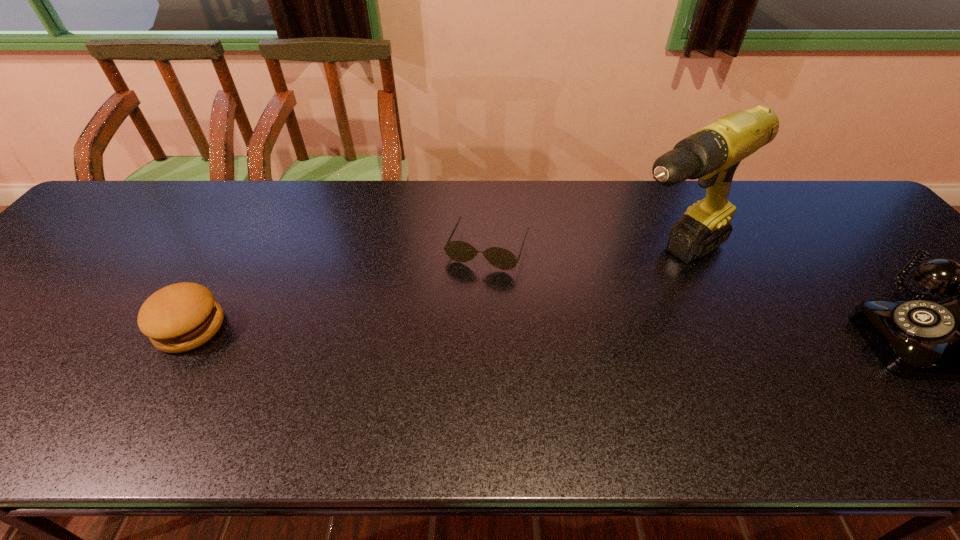
At what (x,y) coordinates should I click in order to perform the action: click on vacant space situated on the front-facing side of the third object from right to left. Please return your answer as a coordinate pair (x, y). The image size is (960, 540). Looking at the image, I should click on (459, 314).

In order to click on blank area located 0.340m on the front-facing side of the third object from right to left in this screenshot , I will do `click(428, 388)`.

This screenshot has width=960, height=540. What are the coordinates of `vacant point located on the front-facing side of the third object from right to left` in the screenshot? It's located at (470, 287).

Identify the location of drill that is at the far edge. This screenshot has width=960, height=540. (712, 154).

I want to click on sunglasses positioned at the far edge, so click(x=459, y=251).

In the image, there is a desktop. At what (x,y) coordinates should I click in order to perform the action: click on vacant area at the far edge. Please return your answer as a coordinate pair (x, y). The height and width of the screenshot is (540, 960). Looking at the image, I should click on (491, 185).

Locate an element on the screen. free point at the near edge is located at coordinates (569, 388).

Identify the location of vacant space at the left edge. This screenshot has height=540, width=960. (53, 275).

This screenshot has height=540, width=960. What are the coordinates of `vacant space that is in between the drill and the shortest object` in the screenshot? It's located at (579, 253).

The height and width of the screenshot is (540, 960). What are the coordinates of `free area in between the third object from left to right and the second object from left to right` in the screenshot? It's located at [579, 253].